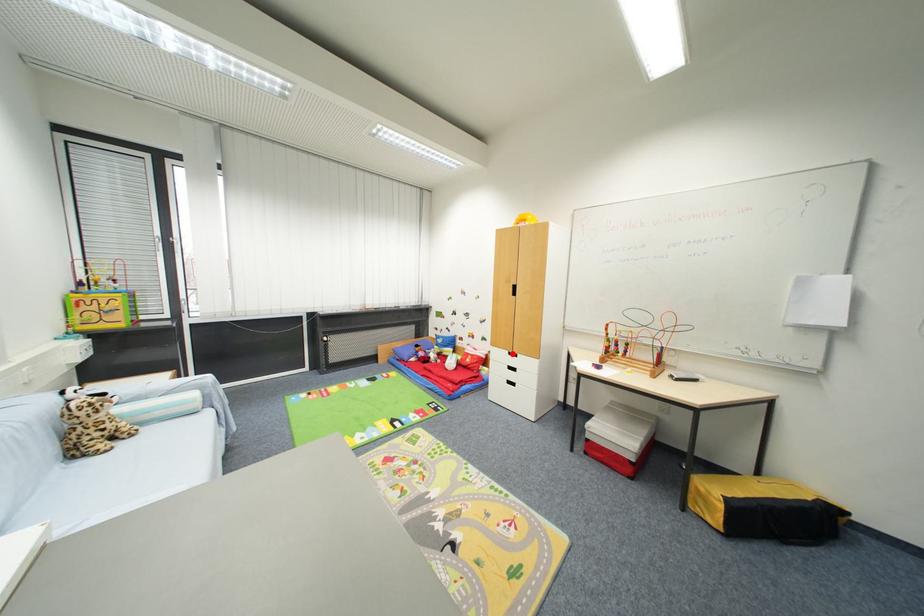
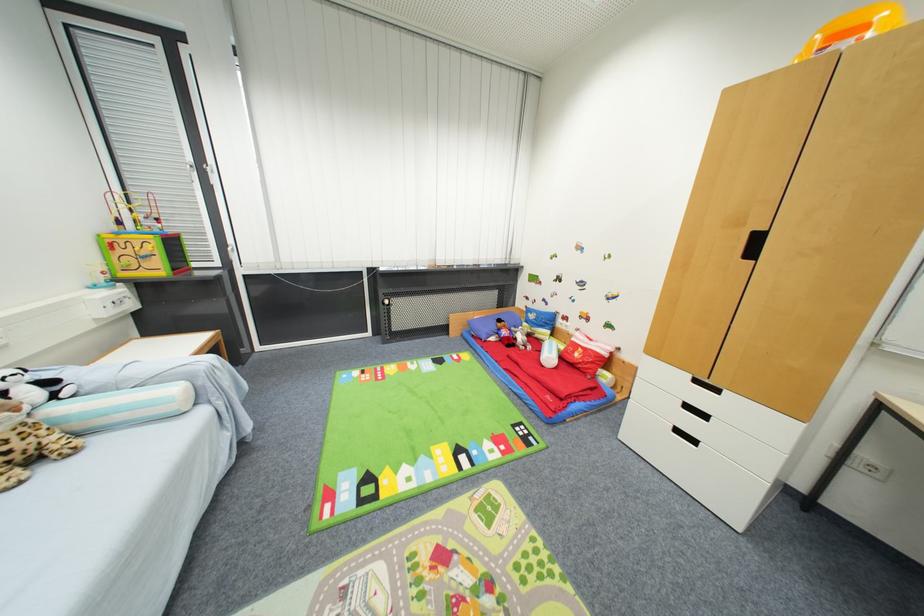
Where in the second image is the point corresponding to the highlighted location from the first image?

(695, 378)